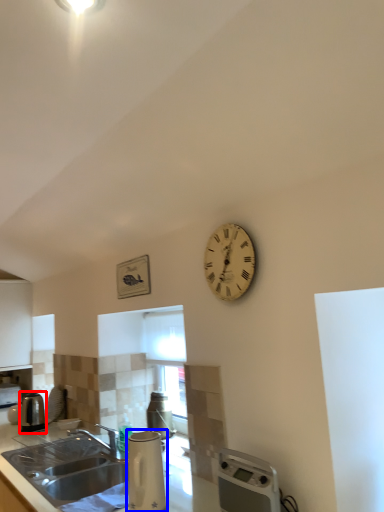
Question: Which object appears farthest to the camera in this image, kitchen appliance (highlighted by a red box) or appliance (highlighted by a blue box)?

Choices:
 (A) kitchen appliance
 (B) appliance

Answer: (A)